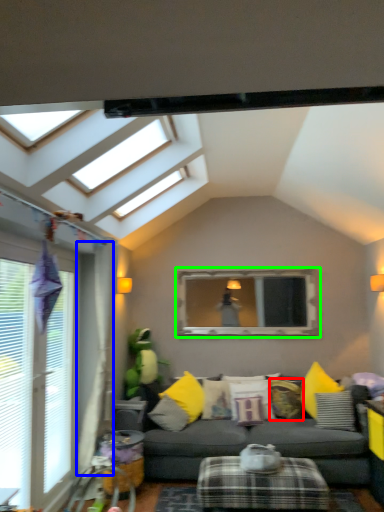
Question: Which object is positioned farthest from pillow (highlighted by a red box)? Select from curtain (highlighted by a blue box) and bay window (highlighted by a green box).

Choices:
 (A) curtain
 (B) bay window

Answer: (A)